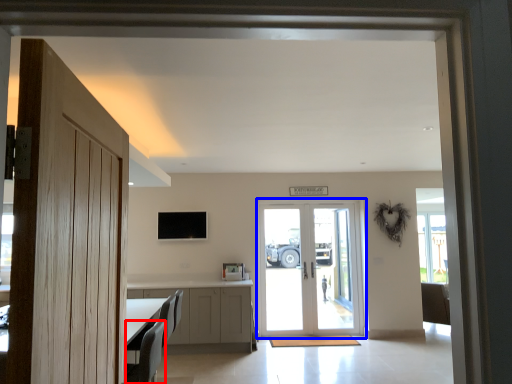
Question: Which object appears farthest to the camera in this image, armchair (highlighted by a red box) or door (highlighted by a blue box)?

Choices:
 (A) armchair
 (B) door

Answer: (B)